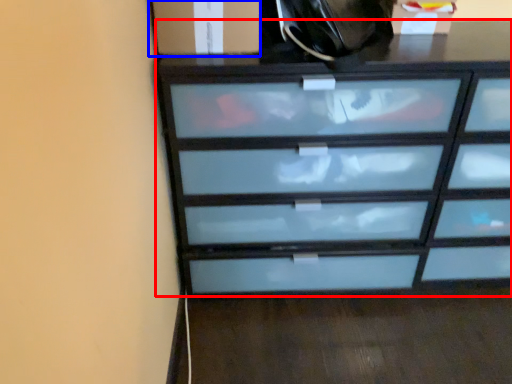
Question: Which point is closer to the camera, chest of drawers (highlighted by a red box) or cabinetry (highlighted by a blue box)?

Choices:
 (A) chest of drawers
 (B) cabinetry

Answer: (A)